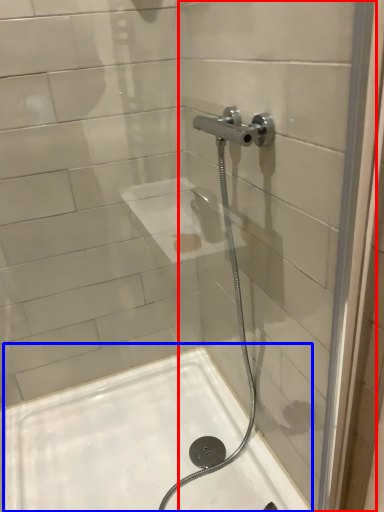
Question: Which object is closer to the camera taking this photo, glass door (highlighted by a red box) or bath (highlighted by a blue box)?

Choices:
 (A) glass door
 (B) bath

Answer: (A)